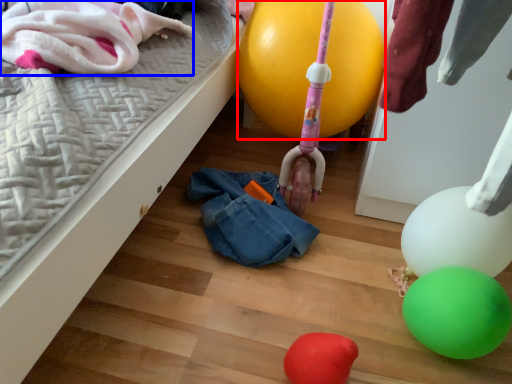
Question: Which object is closer to the camera taking this photo, balloon (highlighted by a red box) or clothing (highlighted by a blue box)?

Choices:
 (A) balloon
 (B) clothing

Answer: (B)